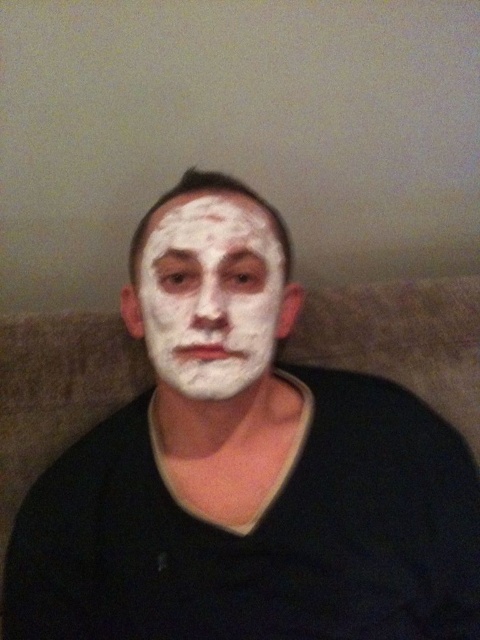
Question: Which point appears closest to the camera in this image?

Choices:
 (A) (460, 451)
 (B) (225, 291)

Answer: (B)

Question: Which point appears farthest from the camera in this image?

Choices:
 (A) (202, 211)
 (B) (262, 321)

Answer: (A)

Question: Is white matte face paint at center to the left of white matte facial mask at center from the viewer's perspective?

Choices:
 (A) yes
 (B) no

Answer: (B)

Question: Does white matte face paint at center have a smaller size compared to white matte facial mask at center?

Choices:
 (A) yes
 (B) no

Answer: (B)

Question: Is white matte face paint at center closer to the viewer compared to white matte facial mask at center?

Choices:
 (A) no
 (B) yes

Answer: (A)